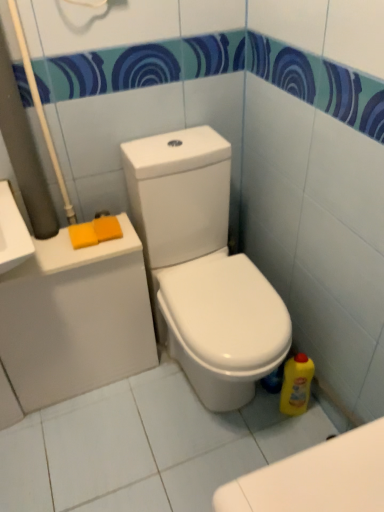
Where is `vacant space situated on the left part of white glossy toilet at center`? This screenshot has height=512, width=384. vacant space situated on the left part of white glossy toilet at center is located at coordinates (107, 425).